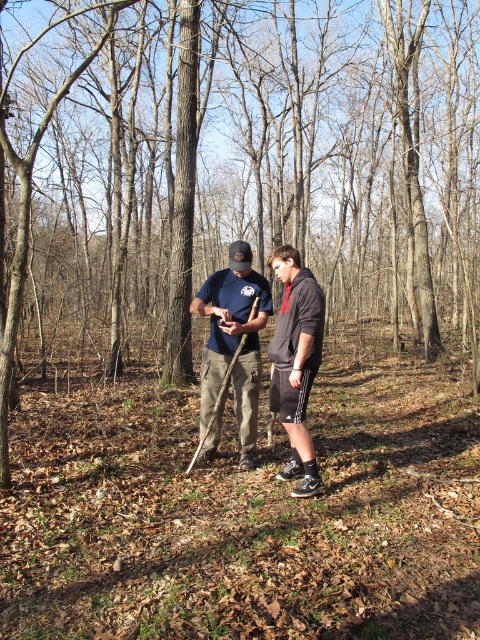
Consider the image. You are standing in the wooded area and want to place a small marker at both points. If you start at point (302, 326) and walk directly towards point (202, 365), will you be moving forward or backward relative to your starting position?

Since point (202, 365) is behind point (302, 326), walking directly towards it would mean moving backward relative to your starting position at point (302, 326).

You are a photographer trying to capture a group photo of the two people in the scene. You want to position yourself so that you are exactly at the point labeled as point (x=233, y=340). When you stand there, which person will be directly in front of you?

The point (x=233, y=340) corresponds to the dark gray hoodie at center, so when you stand there, the person wearing the dark gray hoodie at center will be directly in front of you.